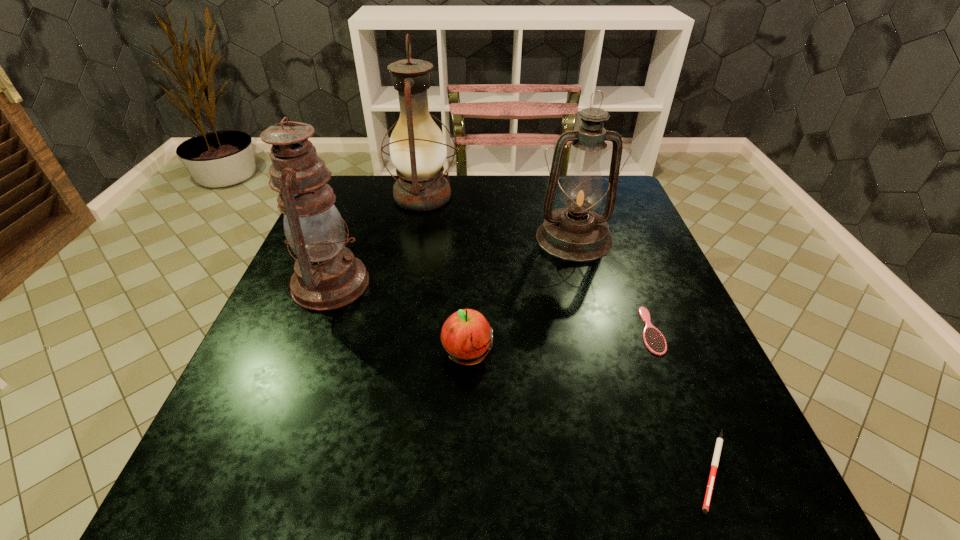
What are the coordinates of `hairbrush that is at the right edge` in the screenshot? It's located at (654, 340).

At what (x,y) coordinates should I click in order to perform the action: click on pen located at the right edge. Please return your answer as a coordinate pair (x, y). Image resolution: width=960 pixels, height=540 pixels. Looking at the image, I should click on (719, 442).

Where is `object present at the far left corner`? This screenshot has width=960, height=540. object present at the far left corner is located at coordinates (418, 151).

You are a GUI agent. You are given a task and a screenshot of the screen. Output one action in this format:
    pyautogui.click(x=<x>, y=<y>)
    Task: Click on the object at the far right corner
    The height and width of the screenshot is (540, 960).
    Given the screenshot: What is the action you would take?
    pyautogui.click(x=576, y=233)

Locate an element on the screen. The image size is (960, 540). object positioned at the near right corner is located at coordinates (719, 442).

Identify the location of vacant space at the far edge of the desktop. The image size is (960, 540). tap(490, 183).

The image size is (960, 540). I want to click on free spot at the near edge of the desktop, so [x=425, y=496].

Where is `vacant area at the left edge`? vacant area at the left edge is located at coordinates (297, 393).

This screenshot has width=960, height=540. In the image, there is a desktop. What are the coordinates of `free space at the right edge` in the screenshot? It's located at [654, 309].

Identify the location of free region at the near right corner of the desktop. (670, 460).